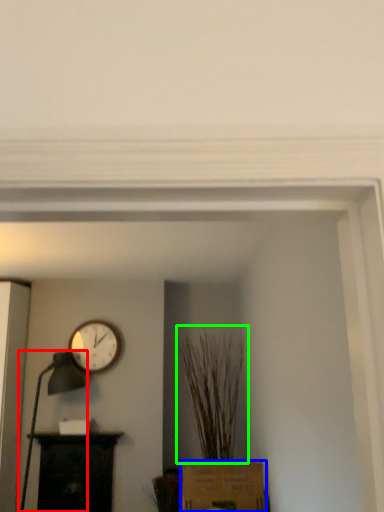
Question: Based on their relative distances, which object is farther from table lamp (highlighted by a red box)? Choose from cardboard box (highlighted by a blue box) and plant (highlighted by a green box).

Choices:
 (A) cardboard box
 (B) plant

Answer: (A)